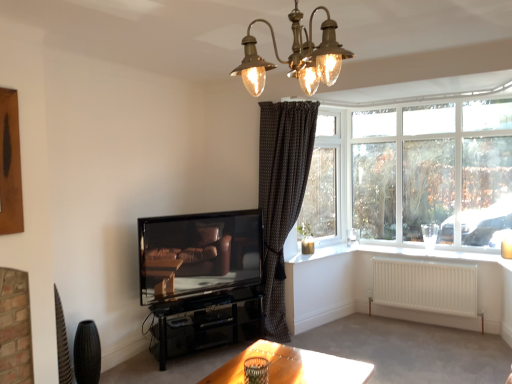
Find the location of a particular element. This screenshot has width=512, height=384. vacant space to the left of white matte radiator at lower right is located at coordinates (374, 334).